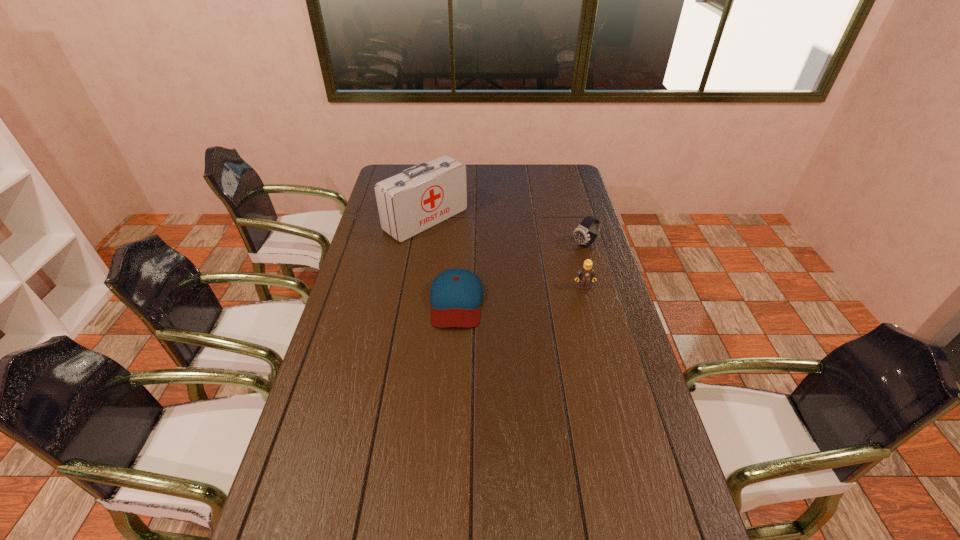
Find the location of a particular element. the shortest object is located at coordinates (456, 295).

You are a GUI agent. You are given a task and a screenshot of the screen. Output one action in this format:
    pyautogui.click(x=<x>, y=<y>)
    Task: Click on the Lego
    The height and width of the screenshot is (540, 960).
    Given the screenshot: What is the action you would take?
    pyautogui.click(x=585, y=274)

What are the coordinates of `the tallest object` in the screenshot? It's located at (420, 197).

The width and height of the screenshot is (960, 540). What are the coordinates of `watch` in the screenshot? It's located at (581, 235).

Find the location of `free space located 0.090m with the bill of the shortest object facing forward`. free space located 0.090m with the bill of the shortest object facing forward is located at coordinates (453, 354).

At what (x,y) coordinates should I click in order to perform the action: click on vacant space located 0.310m in front of the Lego. Please return your answer as a coordinate pair (x, y). The width and height of the screenshot is (960, 540). Looking at the image, I should click on (603, 362).

This screenshot has width=960, height=540. Identify the location of free region located 0.140m on the front-facing side of the first-aid kit. (476, 253).

Where is `free region located 0.260m on the front-facing side of the first-aid kit`? This screenshot has width=960, height=540. free region located 0.260m on the front-facing side of the first-aid kit is located at coordinates (498, 268).

You are a GUI agent. You are given a task and a screenshot of the screen. Output one action in this format:
    pyautogui.click(x=<x>, y=<y>)
    Task: Click on the free space located 0.380m on the front-facing side of the first-aid kit
    
    Given the screenshot: What is the action you would take?
    pyautogui.click(x=522, y=285)

Find the location of a particular element. This screenshot has height=540, width=960. vacant point located 0.160m on the face of the watch is located at coordinates (548, 268).